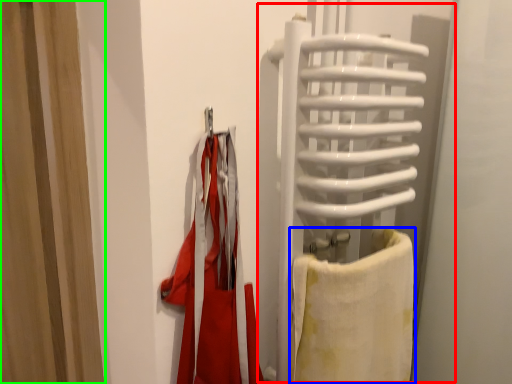
Question: Which object is the farthest from screen door (highlighted by a red box)? Choose among these: towel (highlighted by a blue box) or curtain (highlighted by a green box).

Choices:
 (A) towel
 (B) curtain

Answer: (B)